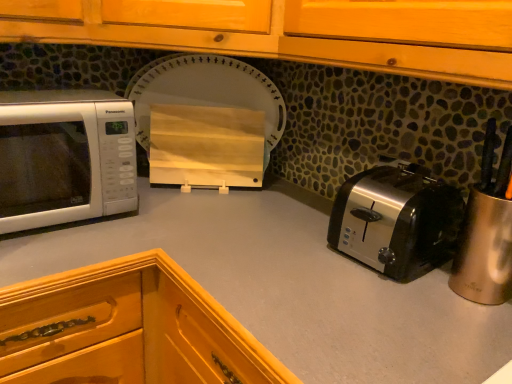
In order to click on free space in front of wooden cutting board at center in this screenshot , I will do `click(173, 208)`.